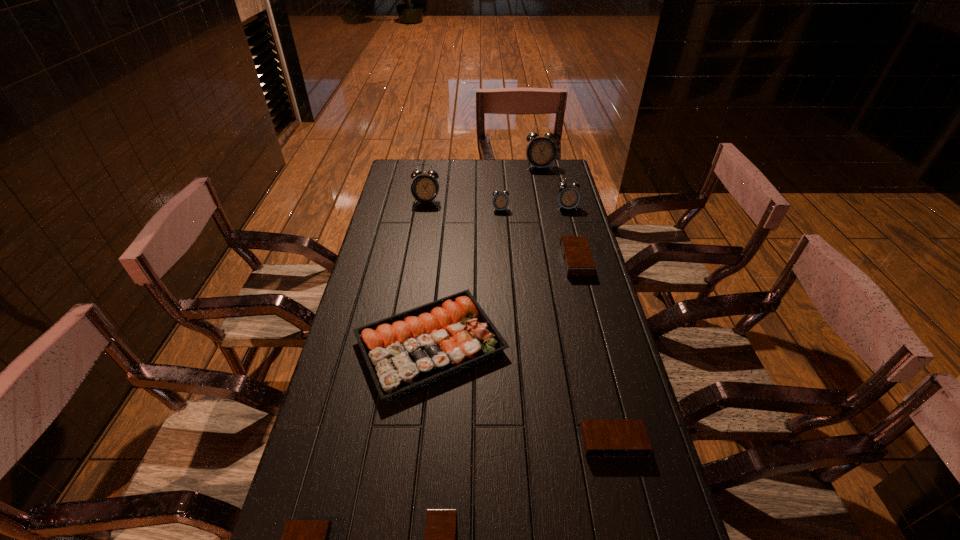
Image resolution: width=960 pixels, height=540 pixels. I want to click on free spot located on the front face of the fifth tallest alarm clock, so click(512, 261).

I want to click on vacant position located 0.140m on the front face of the third shortest object, so click(633, 523).

Where is `object located in the far edge section of the desktop`? object located in the far edge section of the desktop is located at coordinates (540, 152).

This screenshot has height=540, width=960. Identify the location of alarm clock located at the left edge. 425,187.

You are a GUI agent. You are given a task and a screenshot of the screen. Output one action in this format:
    pyautogui.click(x=<x>, y=<y>)
    Task: Click on the platter at the left edge
    The image size is (960, 540).
    Given the screenshot: What is the action you would take?
    pyautogui.click(x=410, y=350)

Where is `object at the far right corner`? object at the far right corner is located at coordinates (540, 152).

At what (x,y) coordinates should I click in order to perform the action: click on vacant area at the far edge. Please return your answer as a coordinate pair (x, y). The width and height of the screenshot is (960, 540). Looking at the image, I should click on (500, 185).

At what (x,y) coordinates should I click in order to perform the action: click on vacant space at the left edge of the desktop. Please return your answer as a coordinate pair (x, y). The width and height of the screenshot is (960, 540). Looking at the image, I should click on (372, 262).

Locate an element on the screen. The height and width of the screenshot is (540, 960). free space at the right edge of the desktop is located at coordinates (556, 252).

In the image, there is a desktop. At what (x,y) coordinates should I click in order to perform the action: click on free region at the far right corner. Please return your answer as a coordinate pair (x, y). Image resolution: width=960 pixels, height=540 pixels. Looking at the image, I should click on (559, 168).